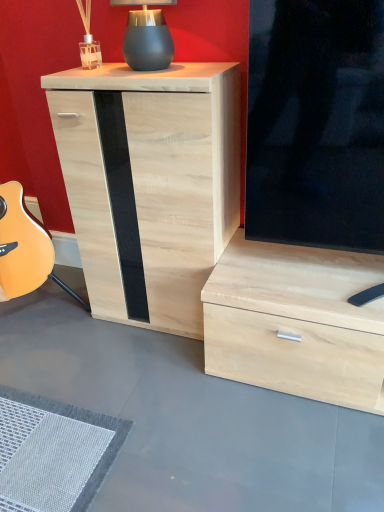
Question: From the image's perspective, is natural wood cabinet at center under matte black lamp at upper center?

Choices:
 (A) no
 (B) yes

Answer: (B)

Question: From a real-world perspective, is natural wood cabinet at center on top of matte black lamp at upper center?

Choices:
 (A) yes
 (B) no

Answer: (B)

Question: Is natural wood cabinet at center bigger than matte black lamp at upper center?

Choices:
 (A) no
 (B) yes

Answer: (B)

Question: Does natural wood cabinet at center appear on the right side of matte black lamp at upper center?

Choices:
 (A) yes
 (B) no

Answer: (A)

Question: From the image's perspective, does natural wood cabinet at center appear higher than matte black lamp at upper center?

Choices:
 (A) no
 (B) yes

Answer: (A)

Question: Is natural wood cabinet at center behind matte black lamp at upper center?

Choices:
 (A) yes
 (B) no

Answer: (B)

Question: Would you consider matte black lamp at upper center to be distant from natural wood cabinet at center?

Choices:
 (A) no
 (B) yes

Answer: (A)

Question: Does matte black lamp at upper center have a smaller size compared to natural wood cabinet at center?

Choices:
 (A) no
 (B) yes

Answer: (B)

Question: Is matte black lamp at upper center at the left side of natural wood cabinet at center?

Choices:
 (A) no
 (B) yes

Answer: (B)

Question: Can you confirm if matte black lamp at upper center is thinner than natural wood cabinet at center?

Choices:
 (A) yes
 (B) no

Answer: (A)

Question: Is matte black lamp at upper center completely or partially outside of natural wood cabinet at center?

Choices:
 (A) no
 (B) yes

Answer: (B)

Question: Is natural wood cabinet at center surrounded by matte black lamp at upper center?

Choices:
 (A) yes
 (B) no

Answer: (B)

Question: From the image's perspective, relative to matte black lamp at upper center, is natural wood cabinet at center above or below?

Choices:
 (A) below
 (B) above

Answer: (A)